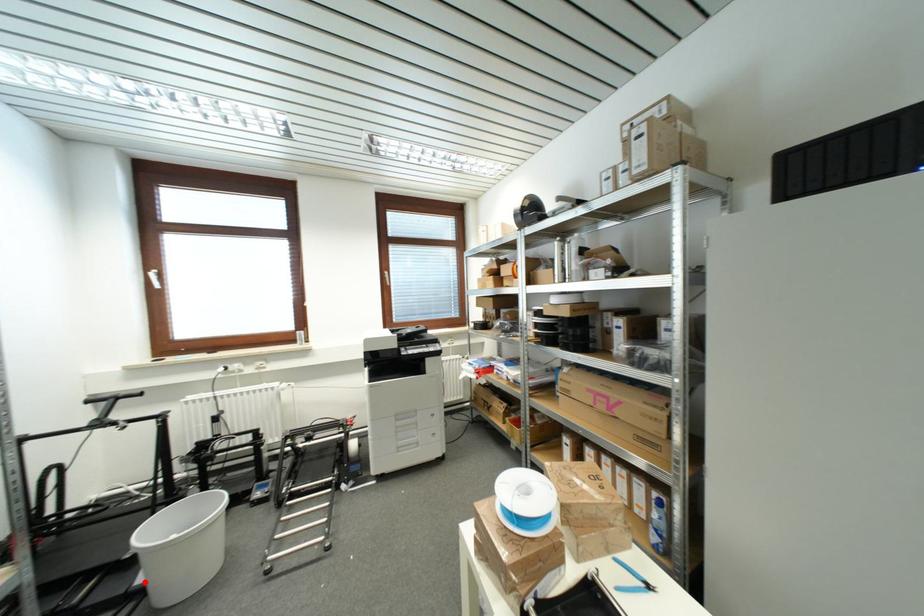
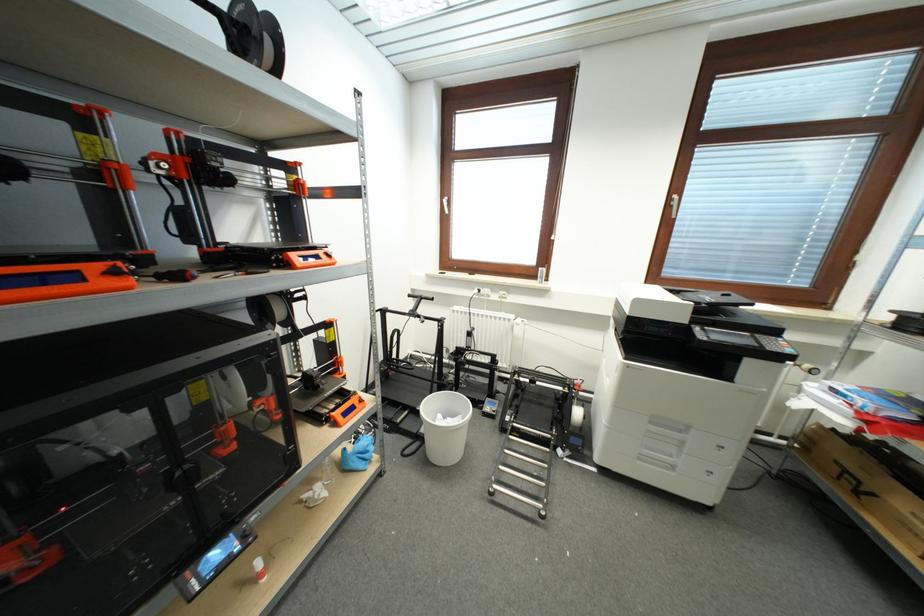
The point at the highlighted location is marked in the first image. Where is the corresponding point in the second image?

(427, 434)